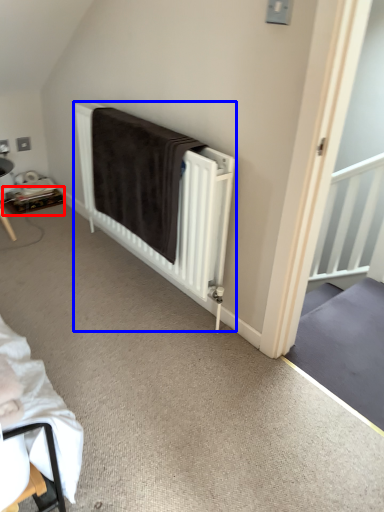
Question: Which object appears farthest to the camera in this image, table (highlighted by a red box) or bed (highlighted by a blue box)?

Choices:
 (A) table
 (B) bed

Answer: (A)